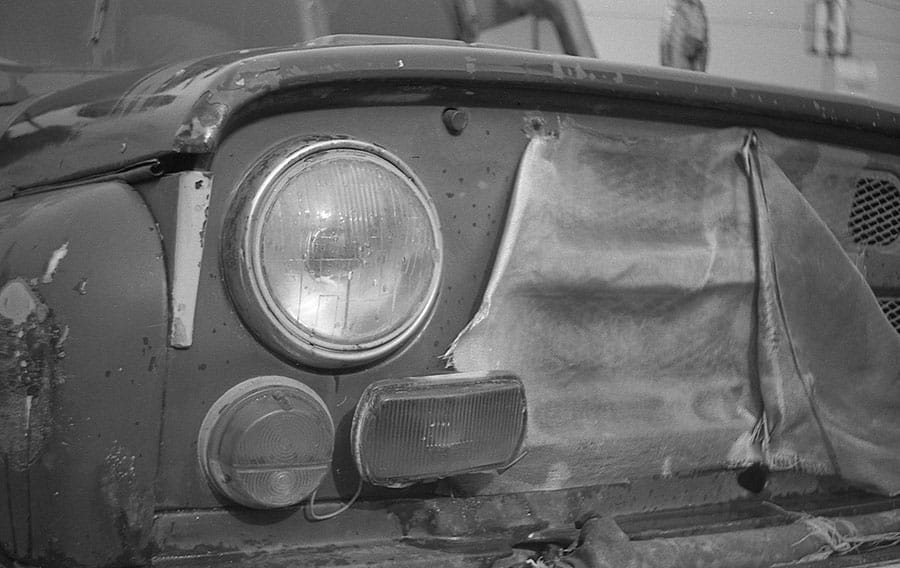
Where is `exhaust vent`? This screenshot has width=900, height=568. exhaust vent is located at coordinates (442, 445).